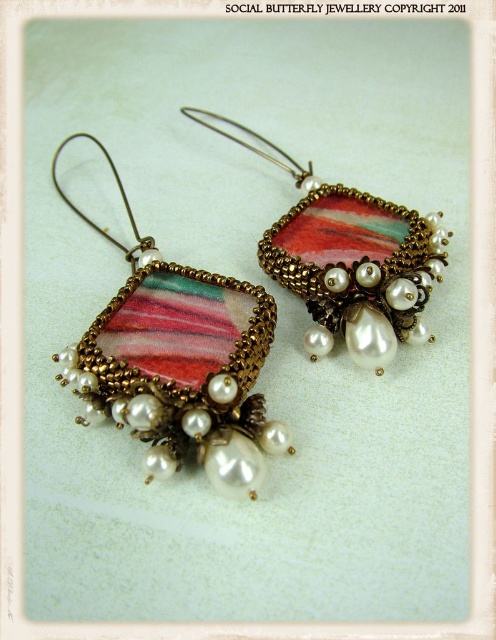
Is matte pink fabric earring at left to the left of multicolored beaded pendant at center from the viewer's perspective?

Indeed, matte pink fabric earring at left is positioned on the left side of multicolored beaded pendant at center.

Is point (66, 138) farther from viewer compared to point (400, 289)?

Yes, point (66, 138) is behind point (400, 289).

The image size is (496, 640). Describe the element at coordinates (179, 362) in the screenshot. I see `matte pink fabric earring at left` at that location.

What are the coordinates of `matte pink fabric earring at left` in the screenshot? It's located at (179, 362).